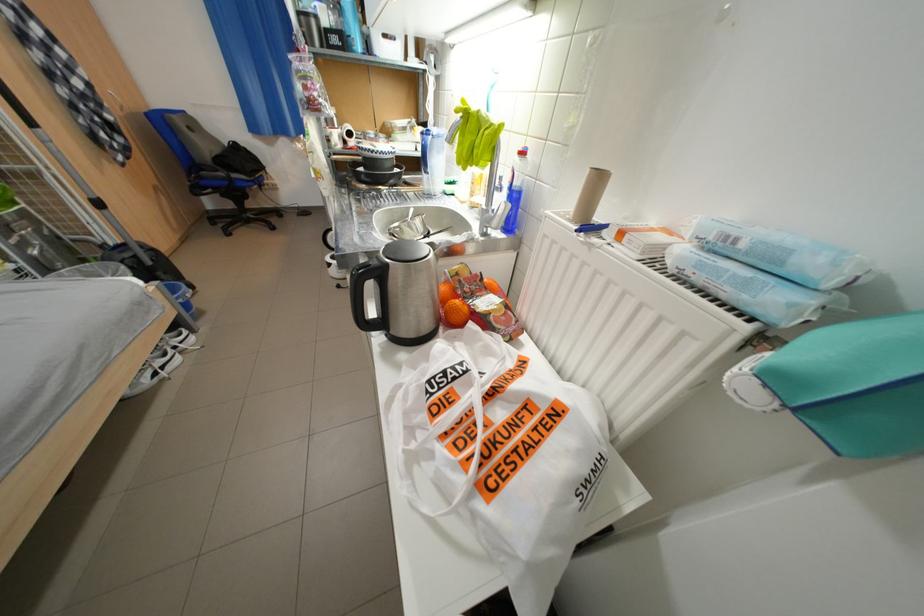
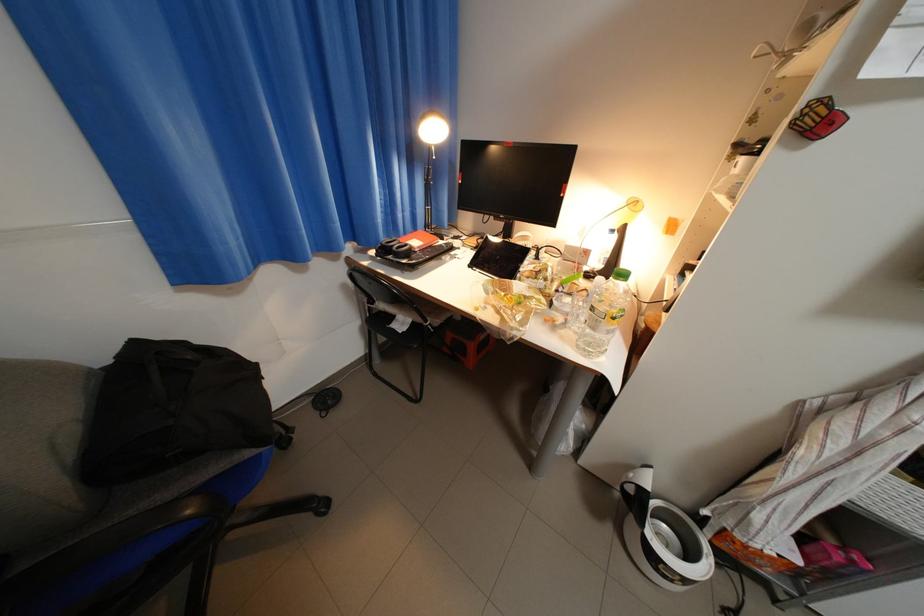
Where in the second image is the point corresponding to [247,145] from the first image?

(147, 344)